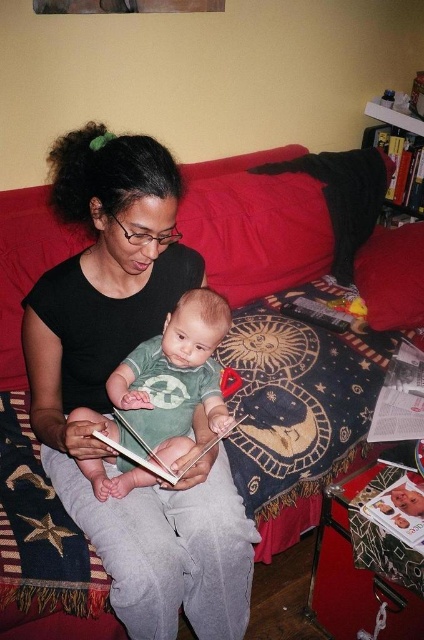
Question: Can you confirm if black matte shirt at center is positioned above matte paper book at lower right?

Choices:
 (A) yes
 (B) no

Answer: (A)

Question: Which object appears farthest from the camera in this image?

Choices:
 (A) black matte shirt at center
 (B) green cotton shirt at center
 (C) white paper book at lower right

Answer: (C)

Question: Among these objects, which one is nearest to the camera?

Choices:
 (A) black matte shirt at center
 (B) matte paper book at lower right

Answer: (A)

Question: Is green cotton shirt at center further to the viewer compared to white paper book at lower right?

Choices:
 (A) no
 (B) yes

Answer: (A)

Question: Estimate the real-world distances between objects in this image. Which object is farther from the white paper book at lower right?

Choices:
 (A) black matte shirt at center
 (B) matte paper book at lower right
 (C) green cotton shirt at center

Answer: (A)

Question: Does white paper book at lower right have a greater width compared to matte paper book at lower right?

Choices:
 (A) yes
 (B) no

Answer: (A)